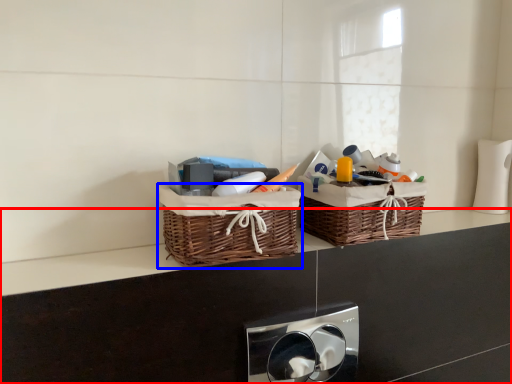
Question: Which of the following is the closest to the observer, counter (highlighted by a red box) or picnic basket (highlighted by a blue box)?

Choices:
 (A) counter
 (B) picnic basket

Answer: (A)